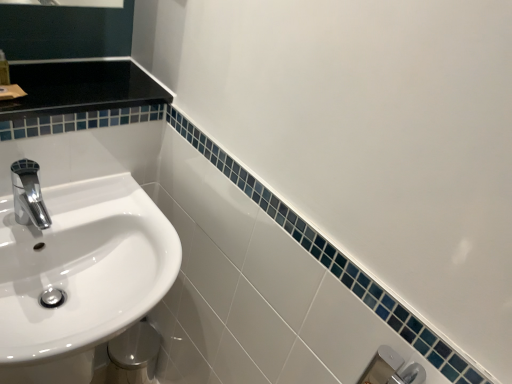
Where is `free space behind chrome/metallic faucet at left`? free space behind chrome/metallic faucet at left is located at coordinates (83, 198).